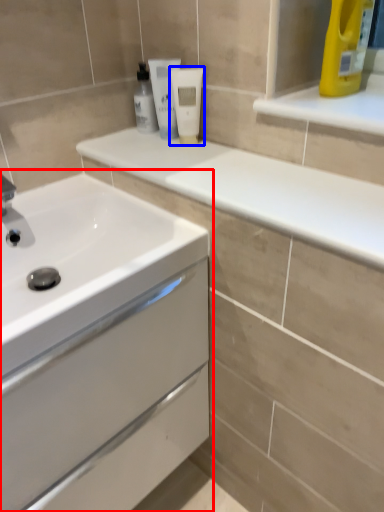
Question: Among these objects, which one is nearest to the camera, bathroom cabinet (highlighted by a red box) or mouthwash (highlighted by a blue box)?

Choices:
 (A) bathroom cabinet
 (B) mouthwash

Answer: (A)